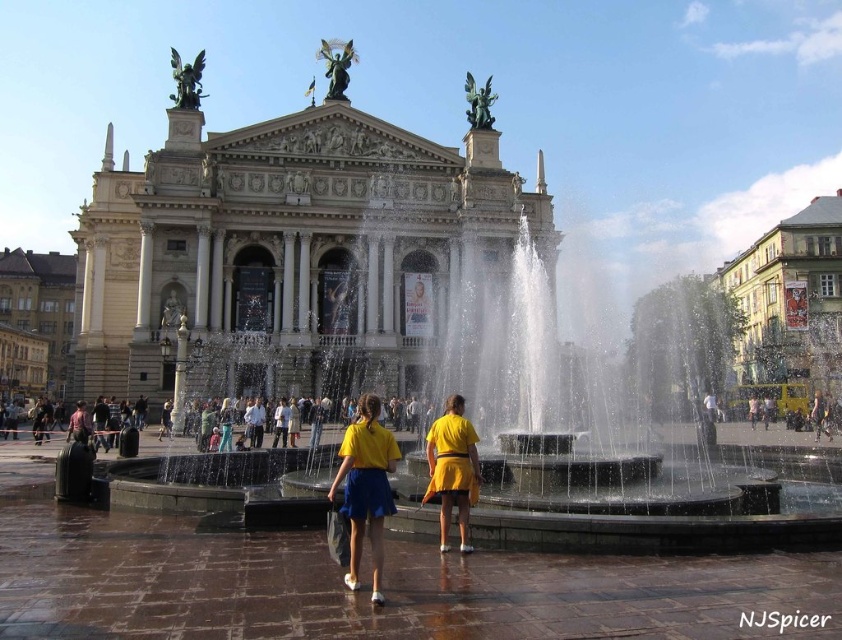
You are a visitor standing at the entrance of the grand building and see both the yellow matte skirt at center and the yellow matte shorts at center. If you want to reach both items, which one should you approach first to minimize the total distance walked?

You should approach either item first as the distance between them is 8.44 meters, so the total distance walked will be the same regardless of the order.

You are a photographer planning to capture the grand building and its fountain. You notice two yellow items at the center of the scene. Which one is wider, the yellow matte skirt at center or the yellow matte shorts at center?

The yellow matte skirt at center is wider than the yellow matte shorts at center according to the description.